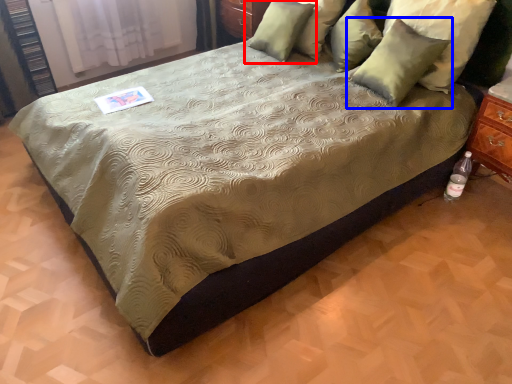
Question: Which of the following is the farthest to the observer, pillow (highlighted by a red box) or pillow (highlighted by a blue box)?

Choices:
 (A) pillow
 (B) pillow

Answer: (A)